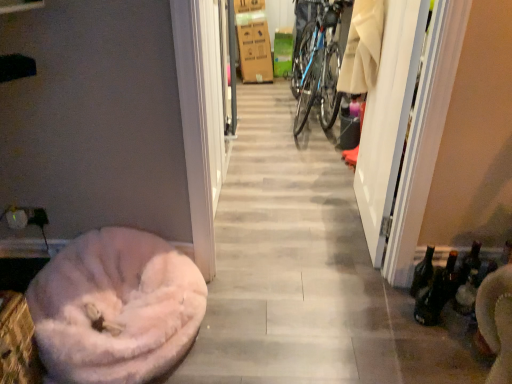
Locate an element on the screen. This screenshot has width=512, height=384. fuzzy pink dog bed at lower left is located at coordinates (116, 307).

This screenshot has width=512, height=384. What do you see at coordinates (302, 55) in the screenshot? I see `blue metallic bicycle tire at center-right` at bounding box center [302, 55].

What is the approximate height of brown cardboard box at upper center?

It is 31.25 inches.

The image size is (512, 384). I want to click on white glossy screen door at right, so click(388, 119).

You are a GUI agent. You are given a task and a screenshot of the screen. Output one action in this format:
    pyautogui.click(x=<x>, y=<y>)
    Task: Click on the blue metallic bicycle at center
    This screenshot has width=512, height=384.
    Given the screenshot: What is the action you would take?
    pyautogui.click(x=318, y=65)

Looking at the image, does blue metallic bicycle tire at center-right seem bigger or smaller compared to brown cardboard box at upper center?

Clearly, blue metallic bicycle tire at center-right is smaller in size than brown cardboard box at upper center.

The image size is (512, 384). What are the coordinates of `tire above the brown cardboard box at upper center (from a real-world perspective)` in the screenshot? It's located at (302, 55).

From their relative heights in the image, would you say blue metallic bicycle tire at center-right is taller or shorter than brown cardboard box at upper center?

In the image, blue metallic bicycle tire at center-right appears to be taller than brown cardboard box at upper center.

Is blue metallic bicycle tire at center-right further to the viewer compared to brown cardboard box at upper center?

No, it is not.

Which of these two, blue metallic bicycle at center or brown cardboard box at upper center, stands shorter?

brown cardboard box at upper center.

At what (x,y) coordinates should I click in order to perform the action: click on cardboard box behind the blue metallic bicycle at center. Please return your answer as a coordinate pair (x, y). The width and height of the screenshot is (512, 384). Looking at the image, I should click on (255, 51).

From the picture: From a real-world perspective, is blue metallic bicycle at center below brown cardboard box at upper center?

No, from a real-world perspective, blue metallic bicycle at center is not under brown cardboard box at upper center.

Locate an element on the screen. This screenshot has height=384, width=512. tire that is under the white glossy screen door at right (from a real-world perspective) is located at coordinates (302, 55).

Can white glossy screen door at right be found inside blue metallic bicycle tire at center-right?

Actually, white glossy screen door at right is outside blue metallic bicycle tire at center-right.

From a real-world perspective, is blue metallic bicycle tire at center-right physically located above or below white glossy screen door at right?

Clearly, from a real-world perspective, blue metallic bicycle tire at center-right is below white glossy screen door at right.

Considering the relative sizes of blue metallic bicycle tire at center-right and blue metallic bicycle at center in the image provided, is blue metallic bicycle tire at center-right taller than blue metallic bicycle at center?

Incorrect, the height of blue metallic bicycle tire at center-right is not larger of that of blue metallic bicycle at center.

Is blue metallic bicycle tire at center-right oriented towards blue metallic bicycle at center?

No, blue metallic bicycle tire at center-right does not turn towards blue metallic bicycle at center.

Is blue metallic bicycle tire at center-right completely or partially outside of blue metallic bicycle at center?

Yes, blue metallic bicycle tire at center-right is located beyond the bounds of blue metallic bicycle at center.

Measure the distance from blue metallic bicycle at center to fuzzy pink dog bed at lower left.

blue metallic bicycle at center and fuzzy pink dog bed at lower left are 1.91 meters apart.

Where is `bicycle located on the right of fuzzy pink dog bed at lower left`? The width and height of the screenshot is (512, 384). bicycle located on the right of fuzzy pink dog bed at lower left is located at coordinates (318, 65).

Is blue metallic bicycle at center looking in the opposite direction of fuzzy pink dog bed at lower left?

No, blue metallic bicycle at center's orientation is not away from fuzzy pink dog bed at lower left.

Which of these two, blue metallic bicycle at center or fuzzy pink dog bed at lower left, is bigger?

blue metallic bicycle at center.

Could white glossy screen door at right be considered to be inside brown cardboard box at upper center?

Actually, white glossy screen door at right is outside brown cardboard box at upper center.

Between brown cardboard box at upper center and white glossy screen door at right, which one has less height?

brown cardboard box at upper center is shorter.

Measure the distance between brown cardboard box at upper center and white glossy screen door at right.

They are 2.77 meters apart.

Could you tell me if blue metallic bicycle tire at center-right is facing fuzzy pink dog bed at lower left?

No, blue metallic bicycle tire at center-right is not facing towards fuzzy pink dog bed at lower left.

From their relative heights in the image, would you say blue metallic bicycle tire at center-right is taller or shorter than fuzzy pink dog bed at lower left?

blue metallic bicycle tire at center-right is taller than fuzzy pink dog bed at lower left.

Who is smaller, blue metallic bicycle tire at center-right or fuzzy pink dog bed at lower left?

blue metallic bicycle tire at center-right is smaller.

What are the coordinates of `cardboard box that is below the blue metallic bicycle tire at center-right (from the image's perspective)` in the screenshot? It's located at (255, 51).

The width and height of the screenshot is (512, 384). What are the coordinates of `cardboard box directly beneath the blue metallic bicycle at center (from a real-world perspective)` in the screenshot? It's located at (255, 51).

In the scene shown: Looking at the image, which one is located closer to blue metallic bicycle at center, white glossy screen door at right or brown cardboard box at upper center?

Based on the image, white glossy screen door at right appears to be nearer to blue metallic bicycle at center.

Considering their positions, is blue metallic bicycle tire at center-right positioned closer to fuzzy pink dog bed at lower left than blue metallic bicycle at center?

Based on the image, blue metallic bicycle at center appears to be nearer to fuzzy pink dog bed at lower left.

Estimate the real-world distances between objects in this image. Which object is further from fuzzy pink dog bed at lower left, blue metallic bicycle at center or brown cardboard box at upper center?

Among the two, brown cardboard box at upper center is located further to fuzzy pink dog bed at lower left.

Which object lies nearer to the anchor point blue metallic bicycle at center, brown cardboard box at upper center or fuzzy pink dog bed at lower left?

The object closer to blue metallic bicycle at center is brown cardboard box at upper center.

Consider the image. Considering their positions, is brown cardboard box at upper center positioned closer to fuzzy pink dog bed at lower left than blue metallic bicycle tire at center-right?

Among the two, blue metallic bicycle tire at center-right is located nearer to fuzzy pink dog bed at lower left.

From the image, which object appears to be nearer to white glossy screen door at right, brown cardboard box at upper center or blue metallic bicycle tire at center-right?

Among the two, blue metallic bicycle tire at center-right is located nearer to white glossy screen door at right.

Based on their spatial positions, is blue metallic bicycle at center or blue metallic bicycle tire at center-right further from brown cardboard box at upper center?

The object further to brown cardboard box at upper center is blue metallic bicycle at center.

When comparing their distances from blue metallic bicycle at center, does fuzzy pink dog bed at lower left or blue metallic bicycle tire at center-right seem further?

fuzzy pink dog bed at lower left is further to blue metallic bicycle at center.

Locate an element on the screen. This screenshot has height=384, width=512. bicycle positioned between fuzzy pink dog bed at lower left and brown cardboard box at upper center from near to far is located at coordinates (318, 65).

Where is `bicycle between white glossy screen door at right and blue metallic bicycle tire at center-right in the front-back direction`? bicycle between white glossy screen door at right and blue metallic bicycle tire at center-right in the front-back direction is located at coordinates (318, 65).

You are a GUI agent. You are given a task and a screenshot of the screen. Output one action in this format:
    pyautogui.click(x=<x>, y=<y>)
    Task: Click on the tire between blue metallic bicycle at center and brown cardboard box at upper center along the z-axis
    This screenshot has width=512, height=384.
    Given the screenshot: What is the action you would take?
    pyautogui.click(x=302, y=55)

I want to click on tire between fuzzy pink dog bed at lower left and brown cardboard box at upper center along the z-axis, so click(x=302, y=55).